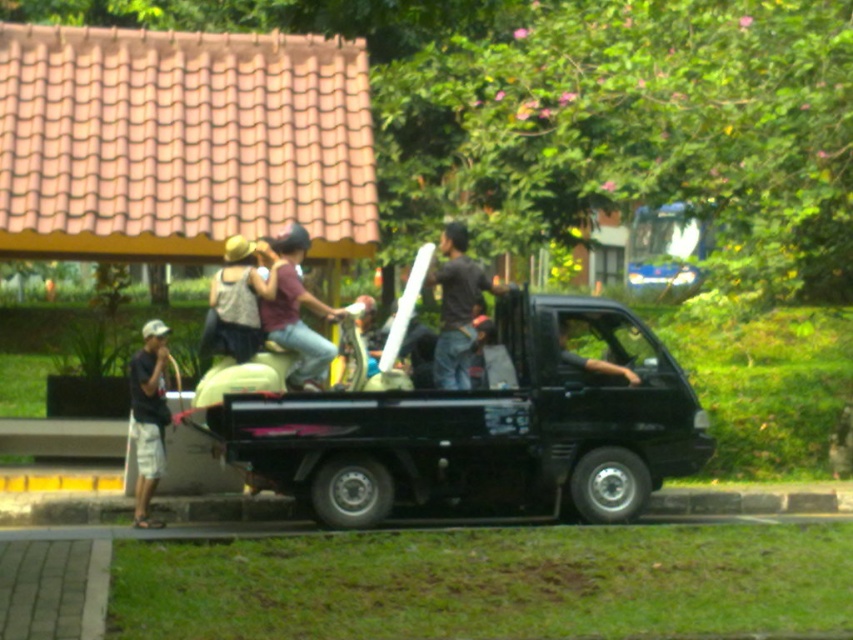
You are a photographer standing at the camera position. You want to take a photo of the dark gray shirt at center. Can you focus on it clearly without moving your camera?

The dark gray shirt at center is 11.70 meters away from the camera. Since most cameras can focus clearly at this distance, you should be able to capture it in focus without moving your camera.

You are standing at the point marked by coordinates point (486,428). What object are you directly facing?

The point (486,428) marks the location of the black glossy pickup truck at center, so you are directly facing the black glossy pickup truck at center.